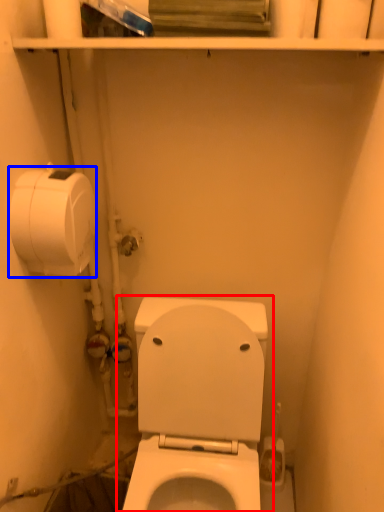
Question: Among these objects, which one is farthest to the camera, toilet (highlighted by a red box) or toilet paper (highlighted by a blue box)?

Choices:
 (A) toilet
 (B) toilet paper

Answer: (B)